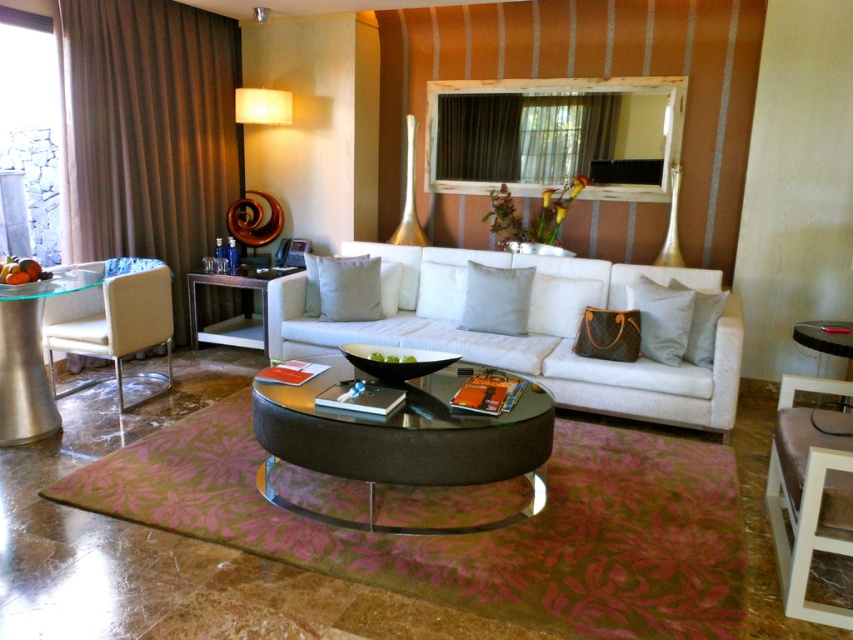
You are standing in the living room and need to place a new lamp on the matte black side table at center. Based on the scene description, where exactly should you place the lamp?

The matte black side table at center is located at point (x=235, y=316), so you should place the lamp there.

You are sitting on the sofa and want to reach the black glass side table at right to grab your phone. Is the gray fabric pillow at center in your way?

The black glass side table at right is behind the gray fabric pillow at center, so the gray fabric pillow at center is blocking the path to the side table. You would need to move the pillow to access the side table.

You are sitting on the sofa and want to place your phone on the closest surface. Which object should you use between the gray fabric pillow at center and the black glass side table at right?

The gray fabric pillow at center is positioned over the black glass side table at right, so the black glass side table at right is closer to you. You should place your phone on the black glass side table at right.